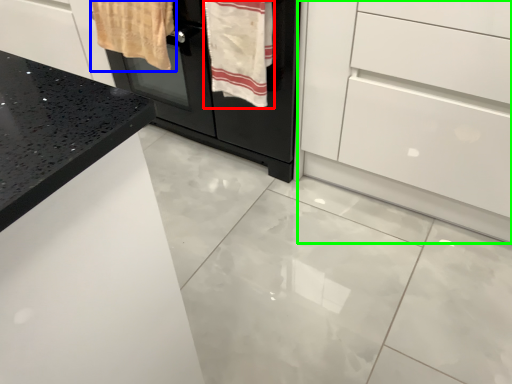
Question: Based on their relative distances, which object is nearer to bath towel (highlighted by a red box)? Choose from bath towel (highlighted by a blue box) and chest of drawers (highlighted by a green box).

Choices:
 (A) bath towel
 (B) chest of drawers

Answer: (A)